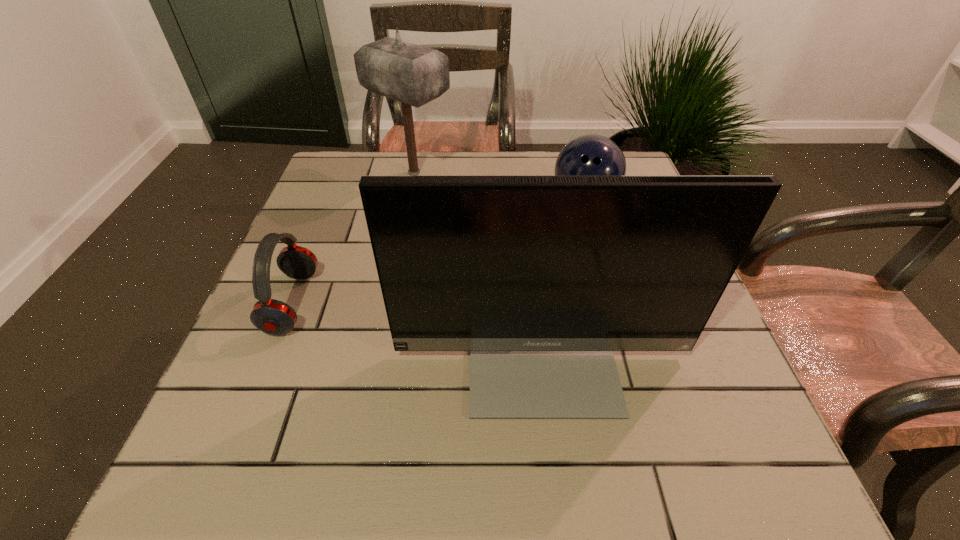
Where is `free location at the near left corner`? This screenshot has width=960, height=540. free location at the near left corner is located at coordinates (255, 446).

Where is `vacant area between the earphone and the mallet`? This screenshot has width=960, height=540. vacant area between the earphone and the mallet is located at coordinates (353, 238).

What are the coordinates of `the third closest object relative to the earphone` in the screenshot? It's located at (589, 155).

You are a GUI agent. You are given a task and a screenshot of the screen. Output one action in this format:
    pyautogui.click(x=<x>, y=<y>)
    Task: Click on the third closest object to the leftmost object
    
    Given the screenshot: What is the action you would take?
    pyautogui.click(x=589, y=155)